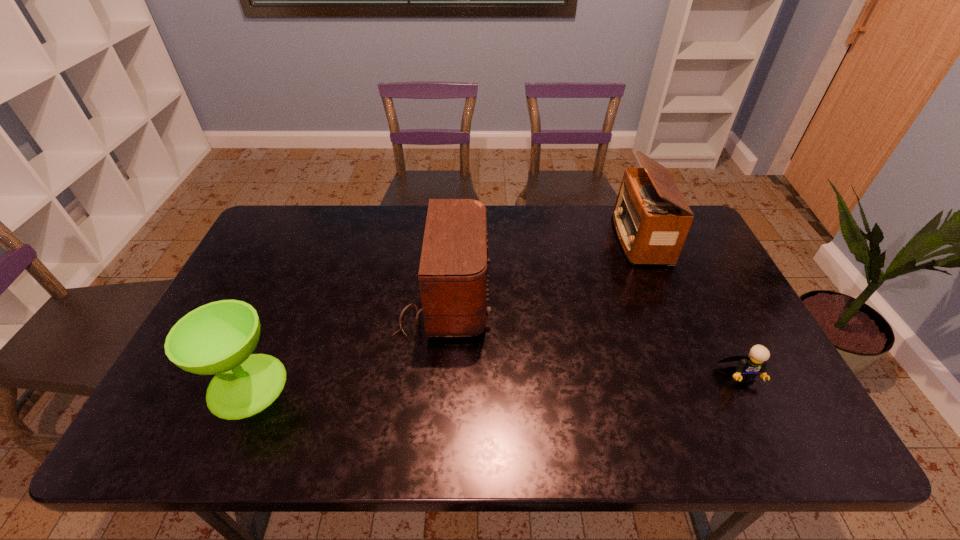
What are the coordinates of `vacant area that lies between the second object from left to right and the right radio receiver` in the screenshot? It's located at (541, 268).

Where is `free area in between the right radio receiver and the Lego`? The image size is (960, 540). free area in between the right radio receiver and the Lego is located at coordinates (690, 307).

Find the location of a particular element. object identified as the closest to the third object from right to left is located at coordinates (218, 338).

The image size is (960, 540). I want to click on object that is the third closest one to the right radio receiver, so click(x=218, y=338).

You are a GUI agent. You are given a task and a screenshot of the screen. Output one action in this format:
    pyautogui.click(x=<x>, y=<y>)
    Task: Click on the vacant space that satisfies the following two spatial constraints: 1. on the front panel of the second object from left to right; 2. on the front side of the leftmost object
    The width and height of the screenshot is (960, 540).
    Given the screenshot: What is the action you would take?
    pyautogui.click(x=437, y=385)